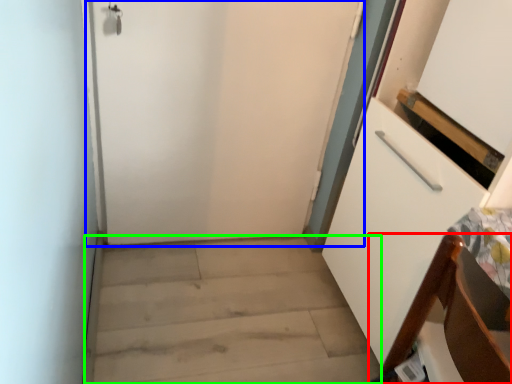
Question: Which object is the closest to the furniture (highlighted by a red box)? Choose among these: door (highlighted by a blue box) or stairwell (highlighted by a green box).

Choices:
 (A) door
 (B) stairwell

Answer: (B)